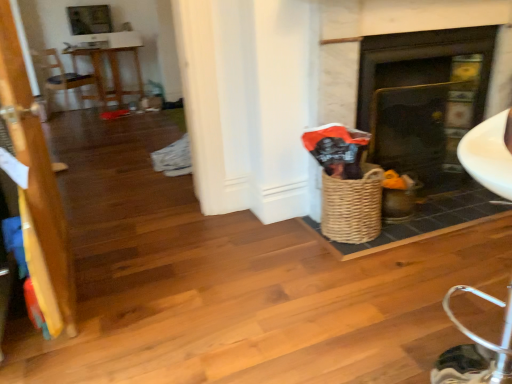
Question: Does wooden table at upper left have a larger size compared to wooden armchair at left?

Choices:
 (A) yes
 (B) no

Answer: (A)

Question: Is wooden table at upper left oriented towards wooden armchair at left?

Choices:
 (A) yes
 (B) no

Answer: (B)

Question: From the image's perspective, does wooden table at upper left appear lower than wooden armchair at left?

Choices:
 (A) yes
 (B) no

Answer: (B)

Question: From a real-world perspective, is wooden table at upper left positioned under wooden armchair at left based on gravity?

Choices:
 (A) no
 (B) yes

Answer: (B)

Question: Is wooden table at upper left positioned with its back to wooden armchair at left?

Choices:
 (A) yes
 (B) no

Answer: (B)

Question: Is wooden table at upper left not close to wooden armchair at left?

Choices:
 (A) yes
 (B) no

Answer: (B)

Question: Would you say matte black fireplace at center contains wooden table at upper left?

Choices:
 (A) yes
 (B) no

Answer: (B)

Question: Does matte black fireplace at center appear on the right side of wooden table at upper left?

Choices:
 (A) no
 (B) yes

Answer: (B)

Question: Does matte black fireplace at center have a greater width compared to wooden table at upper left?

Choices:
 (A) yes
 (B) no

Answer: (B)

Question: From the image's perspective, is matte black fireplace at center on top of wooden table at upper left?

Choices:
 (A) yes
 (B) no

Answer: (B)

Question: Considering the relative sizes of matte black fireplace at center and wooden table at upper left in the image provided, is matte black fireplace at center smaller than wooden table at upper left?

Choices:
 (A) no
 (B) yes

Answer: (B)

Question: Is matte black fireplace at center shorter than wooden table at upper left?

Choices:
 (A) no
 (B) yes

Answer: (A)

Question: Would you say wooden armchair at left is outside matte black fireplace at center?

Choices:
 (A) no
 (B) yes

Answer: (B)